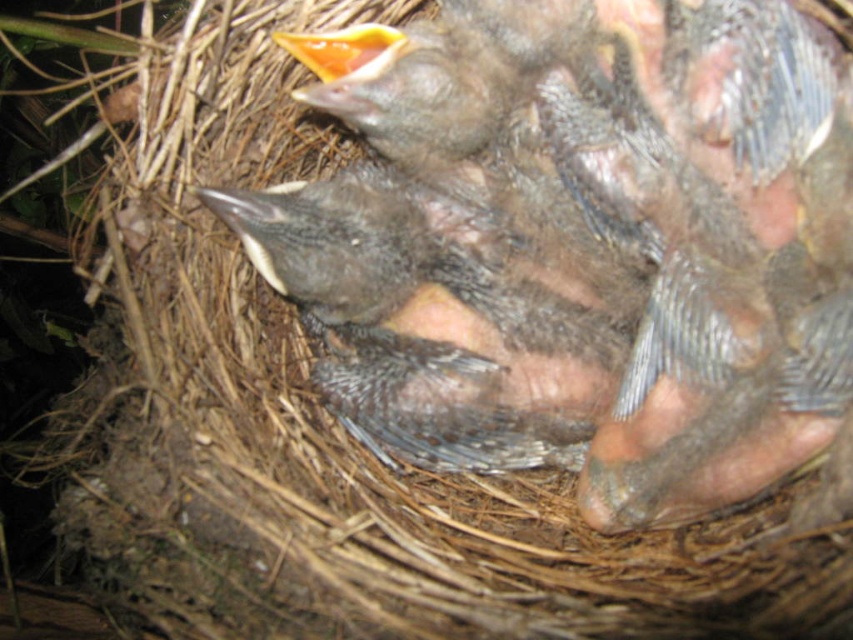
Does dark gray downy feathers at center have a smaller size compared to yellow-orange beak at upper center?

Incorrect, dark gray downy feathers at center is not smaller in size than yellow-orange beak at upper center.

Describe the element at coordinates (587, 250) in the screenshot. I see `dark gray downy feathers at center` at that location.

What do you see at coordinates (587, 250) in the screenshot? I see `dark gray downy feathers at center` at bounding box center [587, 250].

Locate an element on the screen. The height and width of the screenshot is (640, 853). dark gray downy feathers at center is located at coordinates (587, 250).